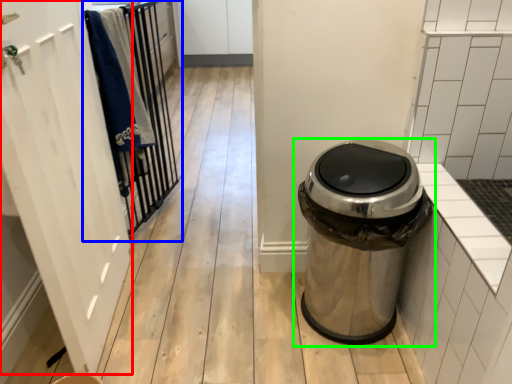
Question: Estimate the real-world distances between objects in this image. Which object is closer to screen door (highlighted by a red box), closet (highlighted by a blue box) or waste container (highlighted by a green box)?

Choices:
 (A) closet
 (B) waste container

Answer: (A)